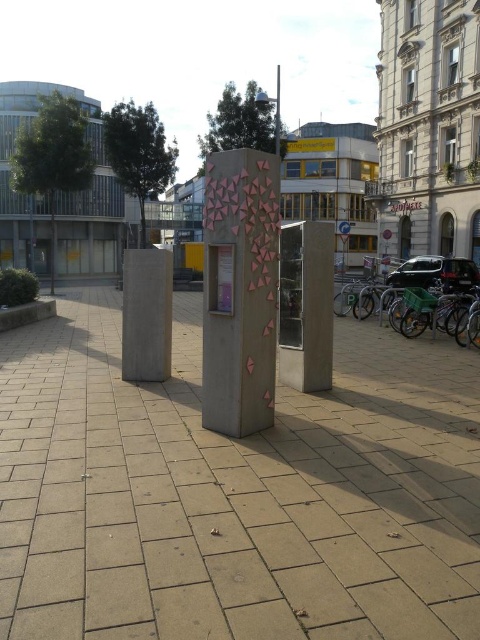
Between concrete pillar at center and smooth concrete pole at center, which one has more height?

With more height is smooth concrete pole at center.

Can you confirm if concrete pillar at center is thinner than smooth concrete pole at center?

Yes.

At what (x,y) coordinates should I click in order to perform the action: click on concrete pillar at center. Please return your answer as a coordinate pair (x, y). This screenshot has height=640, width=480. Looking at the image, I should click on (305, 305).

Find the location of `concrete pillar at center`. concrete pillar at center is located at coordinates (305, 305).

Who is more forward, (432, 296) or (277, 131)?

Positioned in front is point (432, 296).

The width and height of the screenshot is (480, 640). What do you see at coordinates (410, 307) in the screenshot? I see `green plastic bicycle at right` at bounding box center [410, 307].

Where is `green plastic bicycle at right`? This screenshot has width=480, height=640. green plastic bicycle at right is located at coordinates (410, 307).

Describe the element at coordinates (240, 291) in the screenshot. This screenshot has height=640, width=480. I see `pink textured pillar at center` at that location.

Is point (218, 180) less distant than point (452, 296)?

Yes.

Where is `pink textured pillar at center`? This screenshot has height=640, width=480. pink textured pillar at center is located at coordinates (240, 291).